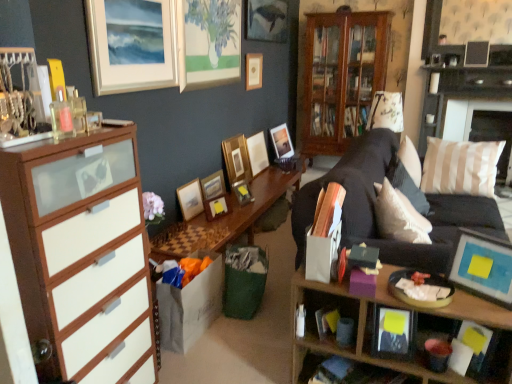
Locate an element on the screen. wooden picture frame at upper center, which ranks as the 3th picture frame in back-to-front order is located at coordinates (254, 71).

Measure the distance between matte silver picture frame at upper left, positioned as the ninth picture frame in back-to-front order, and camera.

matte silver picture frame at upper left, positioned as the ninth picture frame in back-to-front order, is 6.82 feet from camera.

Image resolution: width=512 pixels, height=384 pixels. Describe the element at coordinates (132, 45) in the screenshot. I see `matte silver picture frame at upper left, positioned as the ninth picture frame in back-to-front order` at that location.

You are a GUI agent. You are given a task and a screenshot of the screen. Output one action in this format:
    pyautogui.click(x=<x>, y=<y>)
    Task: Click on the matte black book at lower center, the 3th book when ordered from top to bottom
    Image resolution: width=512 pixels, height=384 pixels.
    Given the screenshot: What is the action you would take?
    pyautogui.click(x=346, y=372)

Measure the distance between matte blue picture frame at lower right, the 11th picture frame in the back-to-front sequence, and camera.

A distance of 5.03 feet exists between matte blue picture frame at lower right, the 11th picture frame in the back-to-front sequence, and camera.

Measure the distance between point (x=276, y=133) and camera.

4.99 meters.

This screenshot has width=512, height=384. Describe the element at coordinates (393, 333) in the screenshot. I see `matte black picture frame at lower right, placed as the tenth picture frame when sorted from back to front` at that location.

Find the location of a particular element. The width and height of the screenshot is (512, 384). wooden picture frame at upper center, which ranks as the 3th picture frame in back-to-front order is located at coordinates (254, 71).

Is matte silver picture frame at upper left, the third picture frame positioned from the front, far from matte wooden picture frame at center, which is the 10th picture frame from front to back?

Absolutely, matte silver picture frame at upper left, the third picture frame positioned from the front, is distant from matte wooden picture frame at center, which is the 10th picture frame from front to back.

Is matte silver picture frame at upper left, positioned as the ninth picture frame in back-to-front order, at the left side of matte wooden picture frame at center, which is the 2th picture frame in back-to-front order?

Yes.

Which object is further away from the camera, matte silver picture frame at upper left, positioned as the ninth picture frame in back-to-front order, or matte wooden picture frame at center, which is the 2th picture frame in back-to-front order?

Positioned behind is matte wooden picture frame at center, which is the 2th picture frame in back-to-front order.

From a real-world perspective, is matte silver picture frame at upper left, positioned as the ninth picture frame in back-to-front order, over matte wooden picture frame at center, which is the 10th picture frame from front to back?

Yes, from a real-world perspective, matte silver picture frame at upper left, positioned as the ninth picture frame in back-to-front order, is on top of matte wooden picture frame at center, which is the 10th picture frame from front to back.

Where is `the 2nd picture frame positioned below the wooden cabinet at center (from a real-world perspective)`? This screenshot has height=384, width=512. the 2nd picture frame positioned below the wooden cabinet at center (from a real-world perspective) is located at coordinates (236, 159).

Could you tell me if wooden picture frame at center, the fourth picture frame from the back, is turned towards wooden cabinet at center?

No, wooden picture frame at center, the fourth picture frame from the back, is not facing towards wooden cabinet at center.

Between wooden picture frame at center, the fourth picture frame from the back, and wooden cabinet at center, which one appears on the left side from the viewer's perspective?

wooden picture frame at center, the fourth picture frame from the back.

Can you confirm if wooden picture frame at center, which is the 8th picture frame from front to back, is wider than wooden cabinet at center?

In fact, wooden picture frame at center, which is the 8th picture frame from front to back, might be narrower than wooden cabinet at center.

Is matte blue picture frame at lower right, the 11th picture frame in the back-to-front sequence, wider than matte wooden picture frame at upper center, which is the 11th picture frame in front-to-back order?

Yes.

Considering the sizes of objects matte blue picture frame at lower right, which ranks as the 1th picture frame in front-to-back order, and matte wooden picture frame at upper center, which is the 11th picture frame in front-to-back order, in the image provided, who is smaller, matte blue picture frame at lower right, which ranks as the 1th picture frame in front-to-back order, or matte wooden picture frame at upper center, which is the 11th picture frame in front-to-back order,?

With smaller size is matte blue picture frame at lower right, which ranks as the 1th picture frame in front-to-back order.

From the image's perspective, is matte blue picture frame at lower right, the 11th picture frame in the back-to-front sequence, located above or below matte wooden picture frame at upper center, which ranks as the first picture frame in back-to-front order?

Based on their image positions, matte blue picture frame at lower right, the 11th picture frame in the back-to-front sequence, is located beneath matte wooden picture frame at upper center, which ranks as the first picture frame in back-to-front order.

Considering the relative sizes of matte wooden picture frame at upper center, which ranks as the first picture frame in back-to-front order, and wooden shelf at lower right in the image provided, is matte wooden picture frame at upper center, which ranks as the first picture frame in back-to-front order, bigger than wooden shelf at lower right?

Actually, matte wooden picture frame at upper center, which ranks as the first picture frame in back-to-front order, might be smaller than wooden shelf at lower right.

Based on the photo, would you say matte wooden picture frame at upper center, which ranks as the first picture frame in back-to-front order, is to the left or to the right of wooden shelf at lower right in the picture?

matte wooden picture frame at upper center, which ranks as the first picture frame in back-to-front order, is positioned on wooden shelf at lower right's left side.

How far apart are matte wooden picture frame at upper center, which is the 11th picture frame in front-to-back order, and wooden shelf at lower right?

matte wooden picture frame at upper center, which is the 11th picture frame in front-to-back order, and wooden shelf at lower right are 10.84 feet apart.

Who is taller, matte wooden picture frame at upper center, which is the 11th picture frame in front-to-back order, or wooden shelf at lower right?

wooden shelf at lower right is taller.

Is wooden picture frame at center, which appears as the fifth picture frame when viewed from the front, outside of metallic gold picture frame at center, placed as the fifth picture frame when sorted from back to front?

That's correct, wooden picture frame at center, which appears as the fifth picture frame when viewed from the front, is outside of metallic gold picture frame at center, placed as the fifth picture frame when sorted from back to front.

From the picture: How different are the orientations of wooden picture frame at center, which appears as the fifth picture frame when viewed from the front, and metallic gold picture frame at center, placed as the fifth picture frame when sorted from back to front, in degrees?

There is a 5.99-degree angle between the facing directions of wooden picture frame at center, which appears as the fifth picture frame when viewed from the front, and metallic gold picture frame at center, placed as the fifth picture frame when sorted from back to front.

Which of these two, wooden picture frame at center, the 7th picture frame in the back-to-front sequence, or metallic gold picture frame at center, placed as the fifth picture frame when sorted from back to front, is smaller?

Smaller between the two is wooden picture frame at center, the 7th picture frame in the back-to-front sequence.

Considering the sizes of objects wooden picture frame at center, which appears as the fifth picture frame when viewed from the front, and white striped pillow at right in the image provided, who is shorter, wooden picture frame at center, which appears as the fifth picture frame when viewed from the front, or white striped pillow at right?

wooden picture frame at center, which appears as the fifth picture frame when viewed from the front.

Measure the distance from wooden picture frame at center, which appears as the fifth picture frame when viewed from the front, to white striped pillow at right.

wooden picture frame at center, which appears as the fifth picture frame when viewed from the front, and white striped pillow at right are 3.92 meters apart from each other.

In the scene shown: Is wooden picture frame at center, the 7th picture frame in the back-to-front sequence, positioned with its back to white striped pillow at right?

wooden picture frame at center, the 7th picture frame in the back-to-front sequence, is not turned away from white striped pillow at right.

Looking at this image, are wooden cabinet at lower right and white textured pillow at right beside each other?

No.

Considering the relative sizes of wooden cabinet at lower right and white textured pillow at right in the image provided, is wooden cabinet at lower right wider than white textured pillow at right?

A: No.

From the image's perspective, is wooden cabinet at lower right located above or below white textured pillow at right?

Clearly, from the image's perspective, wooden cabinet at lower right is below white textured pillow at right.

Would you say wooden cabinet at lower right is outside white textured pillow at right?

That's correct, wooden cabinet at lower right is outside of white textured pillow at right.

From a real-world perspective, count 4th picture frames downward from the matte silver picture frame at upper left, the third picture frame positioned from the front, and point to it. Please provide its 2D coordinates.

[(257, 153)]

In the image, there is a wooden picture frame at center, which is the 8th picture frame from front to back. Identify the location of cabinetry above it (from the image's perspective). (342, 76).

When comparing their distances from matte wooden picture frame at upper center, which ranks as the first picture frame in back-to-front order, does white textured pillow at right or wooden picture frame at center, the eighth picture frame viewed from the back, seem further?

white textured pillow at right.

From the picture: Estimate the real-world distances between objects in this image. Which object is closer to matte black picture frame at lower right, arranged as the 2th picture frame when viewed from the front, matte silver picture frame at upper left, positioned as the ninth picture frame in back-to-front order, or wooden cabinet at lower right?

wooden cabinet at lower right is closer to matte black picture frame at lower right, arranged as the 2th picture frame when viewed from the front.

Estimate the real-world distances between objects in this image. Which object is closer to metallic gold picture frame at center, which is the seventh picture frame from front to back, wooden picture frame at center, the 7th picture frame in the back-to-front sequence, or wooden picture frame at center, the fourth picture frame from the back?

wooden picture frame at center, the 7th picture frame in the back-to-front sequence, is positioned closer to the anchor metallic gold picture frame at center, which is the seventh picture frame from front to back.

Estimate the real-world distances between objects in this image. Which object is closer to matte silver picture frame at upper left, the third picture frame positioned from the front, matte wooden picture frame at center, which is the 10th picture frame from front to back, or wooden cabinet at center?

Among the two, matte wooden picture frame at center, which is the 10th picture frame from front to back, is located nearer to matte silver picture frame at upper left, the third picture frame positioned from the front.

Estimate the real-world distances between objects in this image. Which object is closer to matte silver picture frame at upper left, the third picture frame positioned from the front, wooden picture frame at center, the eighth picture frame viewed from the back, or wooden book at center, which is counted as the third book, starting from the bottom?

Among the two, wooden picture frame at center, the eighth picture frame viewed from the back, is located nearer to matte silver picture frame at upper left, the third picture frame positioned from the front.

Considering their positions, is matte wooden picture frame at upper center, which ranks as the first picture frame in back-to-front order, positioned further to white striped pillow at right than wooden picture frame at center, which is the 8th picture frame from front to back?

Among the two, wooden picture frame at center, which is the 8th picture frame from front to back, is located further to white striped pillow at right.

Based on their spatial positions, is matte black picture frame at lower right, arranged as the 2th picture frame when viewed from the front, or matte wooden picture frame at center, which is the 2th picture frame in back-to-front order, further from wooden picture frame at center, which is the 8th picture frame from front to back?

Based on the image, matte black picture frame at lower right, arranged as the 2th picture frame when viewed from the front, appears to be further to wooden picture frame at center, which is the 8th picture frame from front to back.

Looking at this image, which object lies further to the anchor point matte wooden picture frame at upper center, which ranks as the first picture frame in back-to-front order, wooden book at center, placed as the 1th book when sorted from top to bottom, or metallic gold picture frame at center, placed as the fifth picture frame when sorted from back to front?

wooden book at center, placed as the 1th book when sorted from top to bottom, is further to matte wooden picture frame at upper center, which ranks as the first picture frame in back-to-front order.

Identify the location of chest of drawers between matte silver picture frame at upper left, positioned as the ninth picture frame in back-to-front order, and wooden cabinet at lower right from top to bottom. The image size is (512, 384). (82, 254).

Find the location of a particular element. The width and height of the screenshot is (512, 384). pillow between matte silver picture frame at upper left, positioned as the ninth picture frame in back-to-front order, and matte black book at lower center, which ranks as the 1th book in bottom-to-top order, in the vertical direction is located at coordinates (399, 216).

The height and width of the screenshot is (384, 512). What are the coordinates of `pillow between wooden picture frame at center, which appears as the fifth picture frame when viewed from the front, and white striped pillow at right` in the screenshot? It's located at (399, 216).

The height and width of the screenshot is (384, 512). I want to click on pillow between wooden book at center, which is counted as the third book, starting from the bottom, and white striped pillow at right, along the z-axis, so click(x=399, y=216).